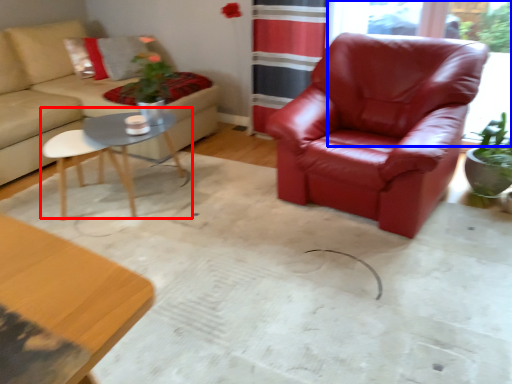
Question: Which object is closer to the camera taking this photo, coffee table (highlighted by a red box) or window screen (highlighted by a blue box)?

Choices:
 (A) coffee table
 (B) window screen

Answer: (A)